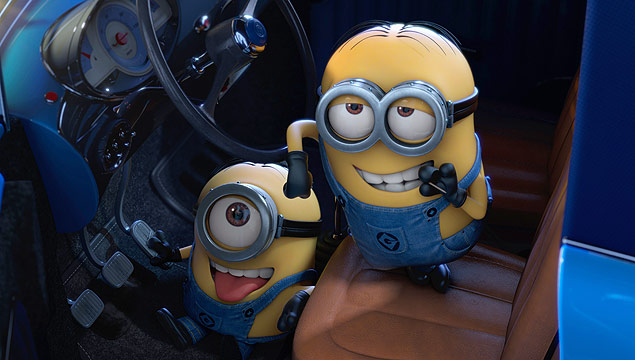
At what (x,y) coordinates should I click in order to perform the action: click on seats. Please return your answer as a coordinate pair (x, y). Looking at the image, I should click on (489, 300), (521, 170).